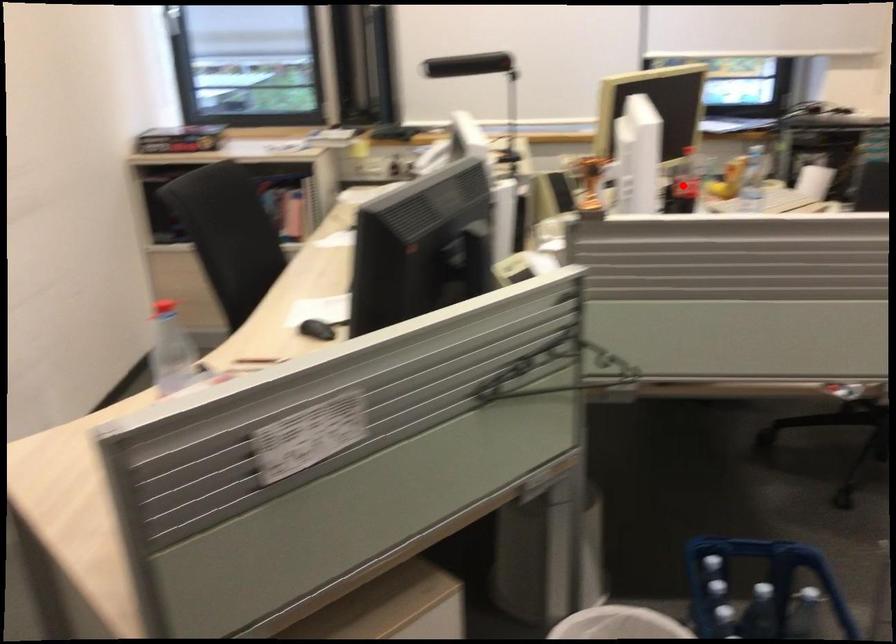
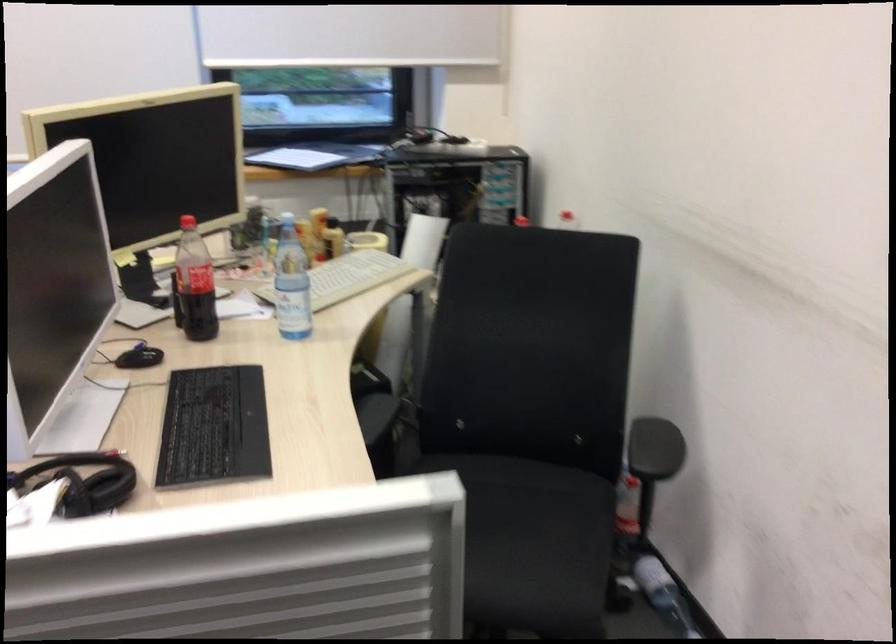
Locate, in the second image, the point that corresponds to the highlighted location in the first image.

(194, 283)